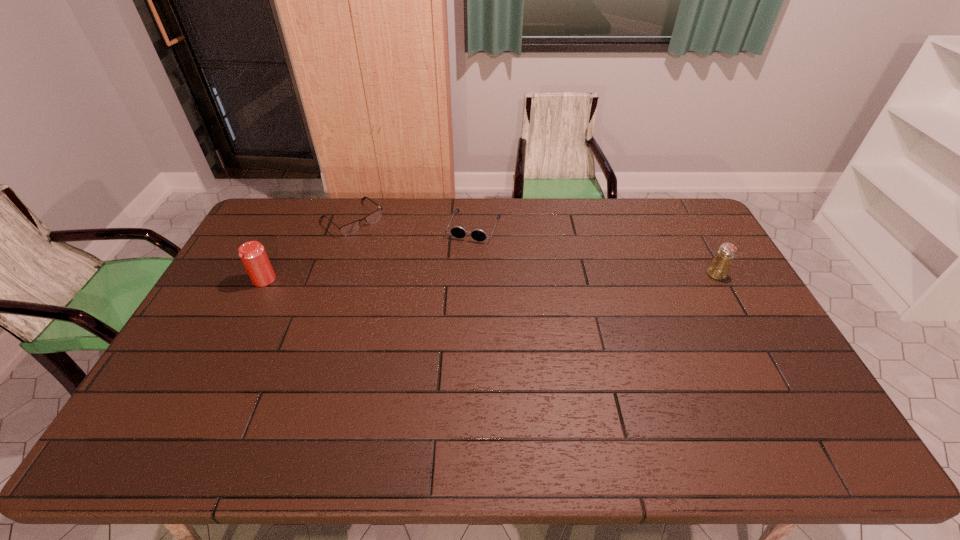
You are a GUI agent. You are given a task and a screenshot of the screen. Output one action in this format:
    pyautogui.click(x=<x>, y=<y>)
    Task: Click on the vacant space on the desktop that is between the beer can and the saltshaker and is positioned on the front-facing side of the third object from left to right
    The width and height of the screenshot is (960, 540).
    Given the screenshot: What is the action you would take?
    pyautogui.click(x=454, y=278)

The height and width of the screenshot is (540, 960). I want to click on free space on the desktop that is between the leftmost object and the rightmost object and is positioned on the front-facing side of the shortest object, so click(425, 278).